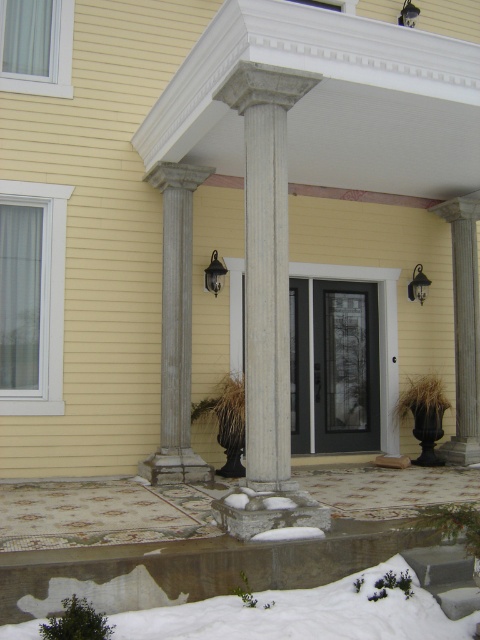
You are standing in front of the residential building entrance. There is a point marked at coordinates (303, 614). What is located at that point?

The point at coordinates (303, 614) marks the location of the white fluffy snow at lower center.

You are standing at the entrance of the residential building and see two points marked on the ground. The first point is at coordinate point (169,435) and the second is at point (423,296). If you want to walk from the first point to the second point, which direction should you move relative to the entrance?

You should move towards the entrance because point (169,435) is in front of point (423,296), meaning the second point is behind the first point relative to the entrance direction.

You are a visitor approaching the entrance of the residential building. You notice the gray stone column at center and the metallic gray wall sconce at upper right. Which object is positioned higher relative to the other?

→ The metallic gray wall sconce at upper right is positioned higher than the gray stone column at center.